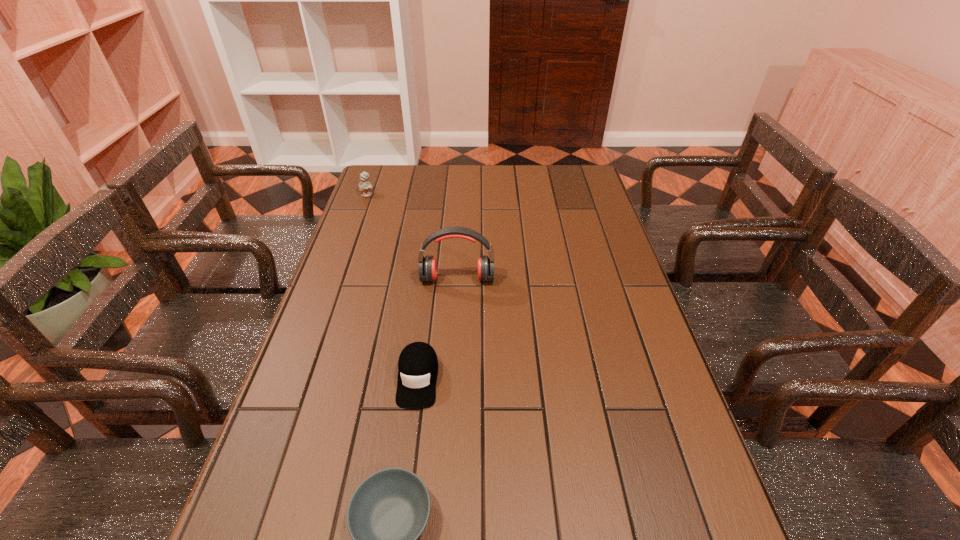
Locate an element on the screen. This screenshot has height=540, width=960. object that is at the left edge is located at coordinates (365, 186).

Image resolution: width=960 pixels, height=540 pixels. In order to click on object at the far left corner in this screenshot , I will do `click(365, 186)`.

Identify the location of vacant area at the far edge. The width and height of the screenshot is (960, 540). (536, 191).

At what (x,y) coordinates should I click in order to perform the action: click on vacant space at the left edge of the desktop. Please return your answer as a coordinate pair (x, y). Looking at the image, I should click on (352, 251).

Locate an element on the screen. vacant space at the right edge of the desktop is located at coordinates (614, 328).

This screenshot has height=540, width=960. Identify the location of free space at the far right corner of the desktop. (581, 181).

I want to click on free point between the earphone and the teddy bear, so click(x=413, y=237).

The height and width of the screenshot is (540, 960). What are the coordinates of `empty space between the leftmost object and the cap` in the screenshot? It's located at (393, 286).

Find the location of a particular element. The height and width of the screenshot is (540, 960). free spot between the second tallest object and the second shortest object is located at coordinates (393, 286).

The height and width of the screenshot is (540, 960). I want to click on vacant point located between the farthest object and the tallest object, so click(413, 237).